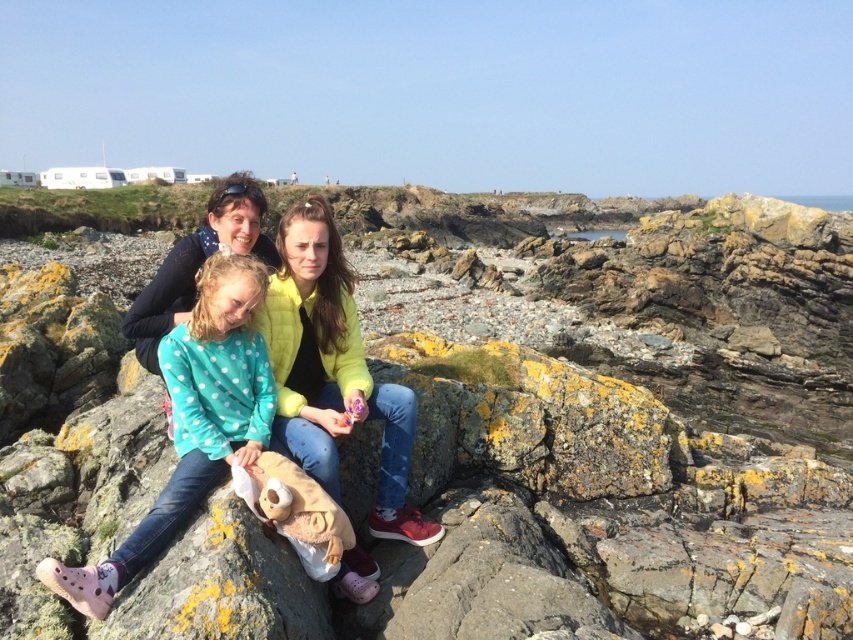
Question: Where is rough textured rock at center located in relation to teal polka dot sweater at center in the image?

Choices:
 (A) below
 (B) above

Answer: (B)

Question: Can you confirm if yellow quilted jacket at center is positioned to the right of teal polka dot sweater at center?

Choices:
 (A) yes
 (B) no

Answer: (A)

Question: Is rough textured rock at center below teal polka dot sweater at center?

Choices:
 (A) no
 (B) yes

Answer: (A)

Question: Which is nearer to the yellow quilted jacket at center?

Choices:
 (A) rough textured rock at center
 (B) teal polka dot sweater at center

Answer: (B)

Question: Which of these objects is positioned closest to the teal polka dot sweater at center?

Choices:
 (A) rough textured rock at center
 (B) yellow quilted jacket at center

Answer: (B)

Question: Considering the real-world distances, which object is farthest from the rough textured rock at center?

Choices:
 (A) teal polka dot sweater at center
 (B) yellow quilted jacket at center

Answer: (B)